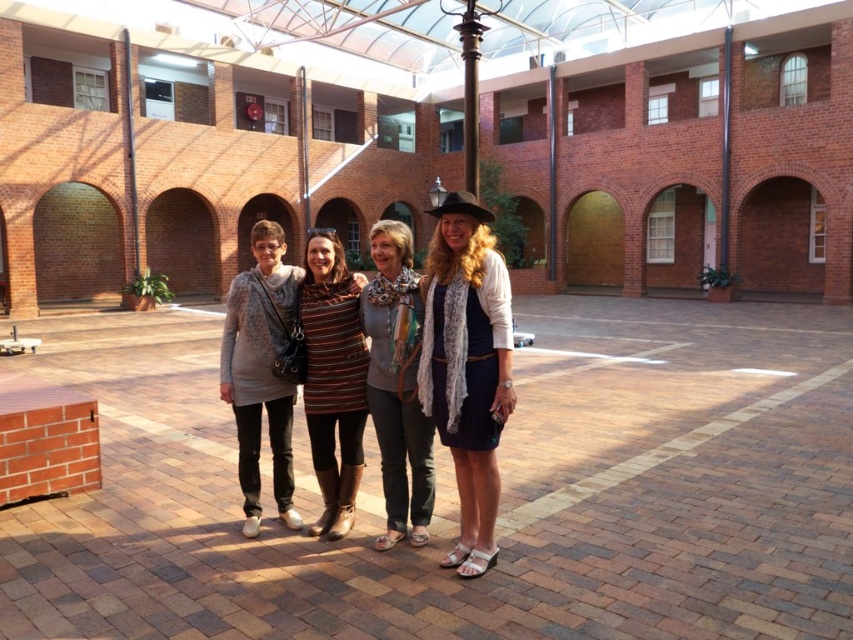
In the scene shown: You are a photographer trying to capture a photo of both the white lace dress at center and the striped fabric dress at center. Since you want to ensure both are in the frame, can you confirm if they are positioned side by side horizontally?

The white lace dress at center is to the right of the striped fabric dress at center, so they are positioned side by side horizontally.

You are a photographer standing in the courtyard and want to capture both the white lace dress at center and the striped fabric dress at center in the same frame. The minimum distance your camera can focus clearly on two objects is 24 inches. Can you include both dresses in the shot without moving closer?

The white lace dress at center is 26.25 inches from the striped fabric dress at center. Since the distance between them is greater than the camera minimum focus distance of 24 inches, the photographer can include both dresses in the shot without moving closer.

You are standing in the courtyard and want to place a small potted plant between the two points, point (463, 461) and point (334, 241). Since you want the plant to be as close as possible to the front of the scene, which point should you position it near?

You should position the potted plant near point (463, 461) because it is closer to the viewer than point (334, 241), making it appear closer to the front of the scene.